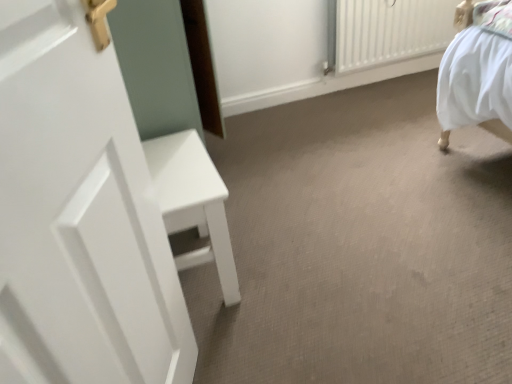
Question: From the image's perspective, is white matte door at left above or below white textured radiator at upper right?

Choices:
 (A) above
 (B) below

Answer: (B)

Question: In terms of width, does white matte door at left look wider or thinner when compared to white textured radiator at upper right?

Choices:
 (A) thin
 (B) wide

Answer: (A)

Question: Considering their positions, is white matte door at left located in front of or behind white textured radiator at upper right?

Choices:
 (A) behind
 (B) front

Answer: (B)

Question: Is white textured radiator at upper right situated inside white matte door at left or outside?

Choices:
 (A) inside
 (B) outside

Answer: (B)

Question: In terms of width, does white textured radiator at upper right look wider or thinner when compared to white matte door at left?

Choices:
 (A) wide
 (B) thin

Answer: (A)

Question: Is white textured radiator at upper right bigger or smaller than white matte door at left?

Choices:
 (A) big
 (B) small

Answer: (A)

Question: Would you say white textured radiator at upper right is to the left or to the right of white matte door at left in the picture?

Choices:
 (A) left
 (B) right

Answer: (B)